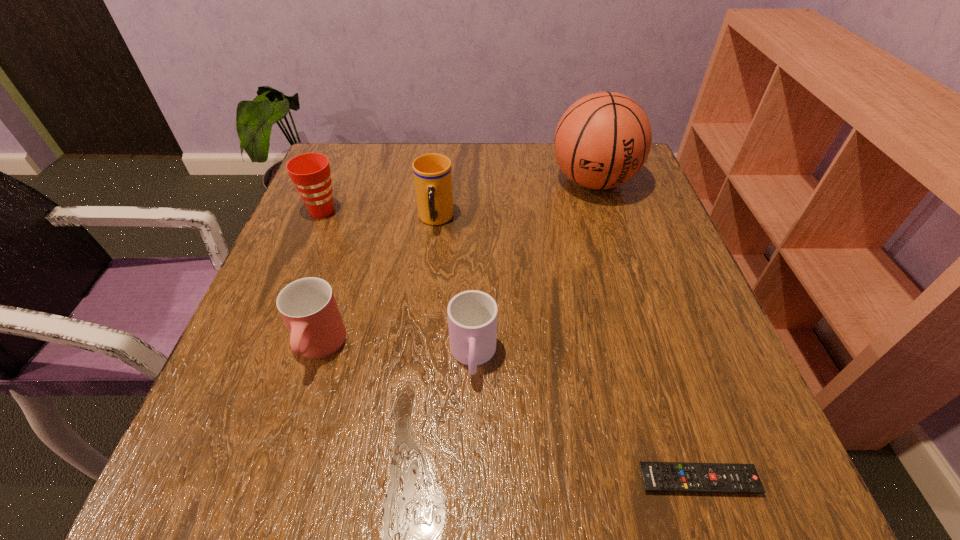
Select which cup appears as the closest to the leftmost cup. Please provide its 2D coordinates. Your answer should be formatted as a tuple, i.e. [(x, y)], where the tuple contains the x and y coordinates of a point satisfying the conditions above.

[(432, 172)]

Locate an element on the screen. free space in the image that satisfies the following two spatial constraints: 1. on the surface of the shortest object near the brand logo; 2. on the left side of the tallest object is located at coordinates (686, 480).

Find the location of a particular element. vacant space that satisfies the following two spatial constraints: 1. with the handle on the side of the rightmost cup; 2. on the right side of the remote control is located at coordinates (471, 480).